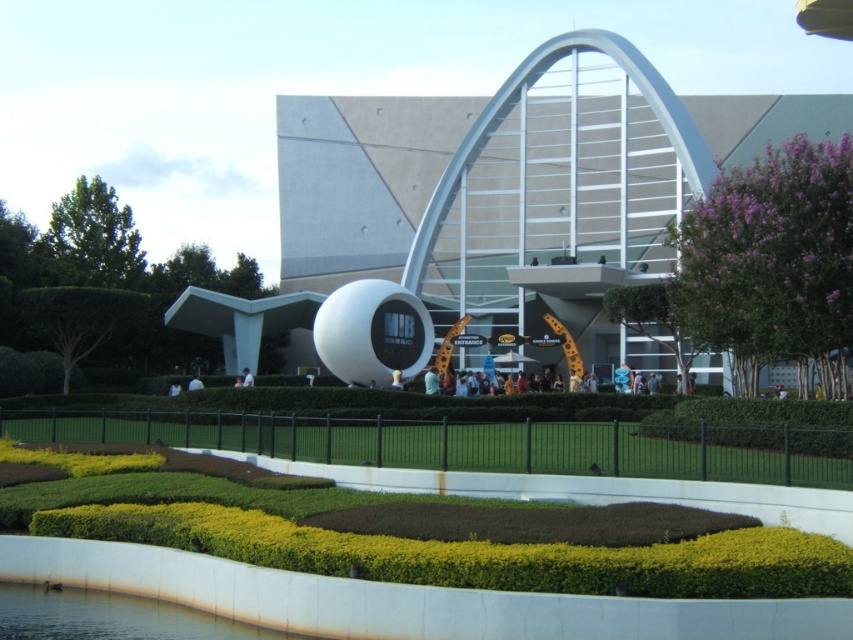
Question: Can you confirm if white smooth sphere at center is positioned to the right of green leafy hedge at upper right?

Choices:
 (A) yes
 (B) no

Answer: (B)

Question: Does white smooth sphere at center have a smaller size compared to green leafy hedge at upper right?

Choices:
 (A) no
 (B) yes

Answer: (A)

Question: Which point appears farthest from the camera in this image?

Choices:
 (A) (608, 278)
 (B) (706, 348)

Answer: (A)

Question: Which point is closer to the camera taking this photo?

Choices:
 (A) (769, 262)
 (B) (511, 173)

Answer: (A)

Question: Among these points, which one is farthest from the camera?

Choices:
 (A) (335, 140)
 (B) (798, 333)

Answer: (A)

Question: From the image, what is the correct spatial relationship of white smooth sphere at center in relation to green leafy hedge at upper right?

Choices:
 (A) above
 (B) below

Answer: (A)